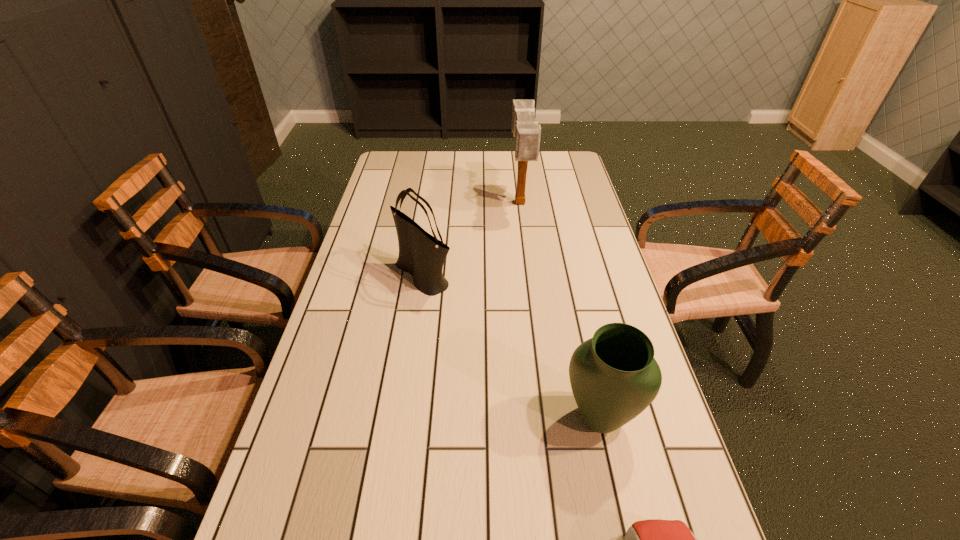
Image resolution: width=960 pixels, height=540 pixels. I want to click on mallet, so click(x=526, y=130).

Find the location of `shoulder bag`. shoulder bag is located at coordinates (422, 255).

Locate an element on the screen. Image resolution: width=960 pixels, height=540 pixels. the third nearest object is located at coordinates (422, 255).

Locate an element on the screen. The image size is (960, 540). the third tallest object is located at coordinates (614, 376).

Where is `the second nearest object`? The image size is (960, 540). the second nearest object is located at coordinates (614, 376).

Where is `vacant space located on the left of the mallet`? The width and height of the screenshot is (960, 540). vacant space located on the left of the mallet is located at coordinates (415, 204).

This screenshot has height=540, width=960. Identify the location of vacant point located on the front of the shoulder bag. (416, 332).

Locate an element on the screen. The image size is (960, 540). blank area located 0.250m on the left of the second shortest object is located at coordinates (448, 417).

I want to click on object at the left edge, so click(x=422, y=255).

At what (x,y) coordinates should I click in order to perform the action: click on object present at the right edge. Please return your answer as a coordinate pair (x, y). Looking at the image, I should click on (614, 376).